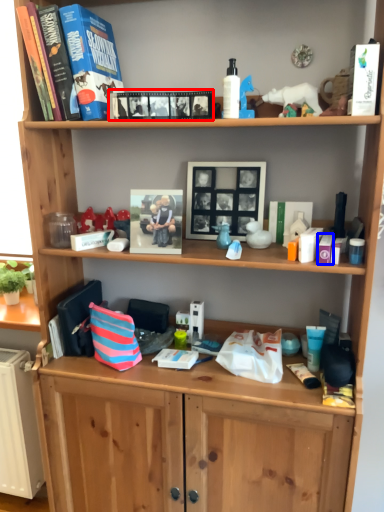
Question: Among these objects, which one is farthest to the camera, book (highlighted by a red box) or toiletry (highlighted by a blue box)?

Choices:
 (A) book
 (B) toiletry

Answer: (B)